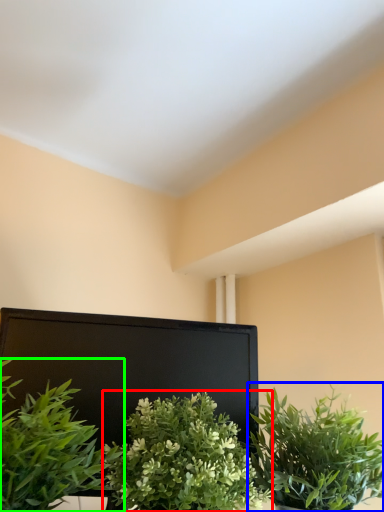
Question: Which is farther away from houseplant (highlighted by a red box)? houseplant (highlighted by a blue box) or houseplant (highlighted by a green box)?

Choices:
 (A) houseplant
 (B) houseplant

Answer: (A)